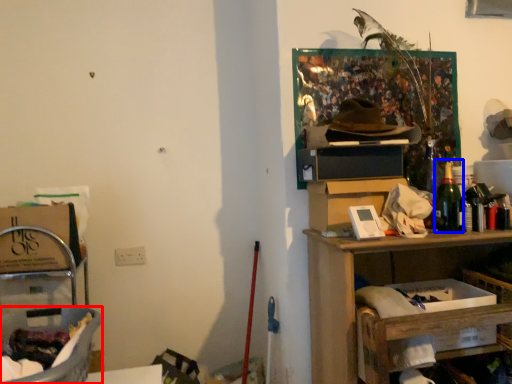
Question: Which point is closer to the camera, laundry basket (highlighted by a red box) or bottle (highlighted by a blue box)?

Choices:
 (A) laundry basket
 (B) bottle

Answer: (A)